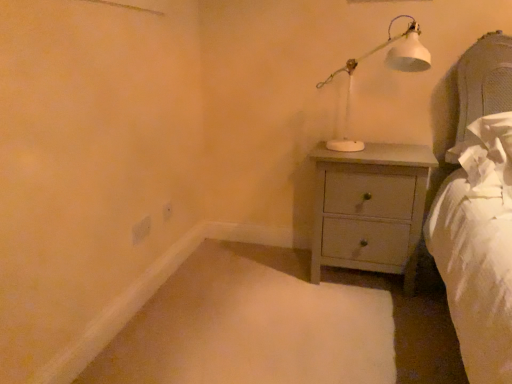
Question: From a real-world perspective, relative to light gray wood chest of drawers at center-right, is white matte table lamp at upper right vertically above or below?

Choices:
 (A) above
 (B) below

Answer: (A)

Question: Is white matte table lamp at upper right taller or shorter than light gray wood chest of drawers at center-right?

Choices:
 (A) tall
 (B) short

Answer: (B)

Question: Which of these objects is positioned closest to the white matte table lamp at upper right?

Choices:
 (A) light gray wood chest of drawers at center-right
 (B) white matte electric outlet at lower left, acting as the second electric outlet starting from the right
 (C) white plastic electric outlet at lower center, the 1th electric outlet viewed from the right

Answer: (A)

Question: Which is nearer to the white plastic electric outlet at lower center, which is the second electric outlet in front-to-back order?

Choices:
 (A) light gray wood chest of drawers at center-right
 (B) white matte table lamp at upper right
 (C) white matte electric outlet at lower left, which is counted as the first electric outlet, starting from the left

Answer: (C)